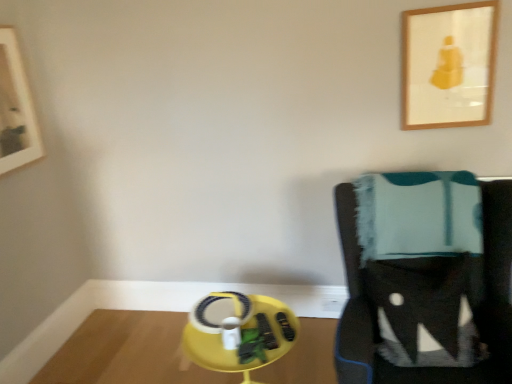
Question: Considering the relative sizes of yellow plastic table at lower center and knitted wool blanket at right in the image provided, is yellow plastic table at lower center smaller than knitted wool blanket at right?

Choices:
 (A) no
 (B) yes

Answer: (B)

Question: Is yellow plastic table at lower center positioned behind knitted wool blanket at right?

Choices:
 (A) yes
 (B) no

Answer: (A)

Question: Is yellow plastic table at lower center bigger than knitted wool blanket at right?

Choices:
 (A) yes
 (B) no

Answer: (B)

Question: Could knitted wool blanket at right be considered to be inside yellow plastic table at lower center?

Choices:
 (A) no
 (B) yes

Answer: (A)

Question: From a real-world perspective, is yellow plastic table at lower center under knitted wool blanket at right?

Choices:
 (A) yes
 (B) no

Answer: (A)

Question: Would you say yellow plastic table at lower center is outside knitted wool blanket at right?

Choices:
 (A) yes
 (B) no

Answer: (A)

Question: Does knitted wool blanket at right come behind wooden picture frame at upper left, the 1th picture frame from the left?

Choices:
 (A) no
 (B) yes

Answer: (A)

Question: From the image's perspective, does knitted wool blanket at right appear lower than wooden picture frame at upper left, the 1th picture frame from the left?

Choices:
 (A) no
 (B) yes

Answer: (B)

Question: Is wooden picture frame at upper left, positioned as the second picture frame in right-to-left order, surrounded by knitted wool blanket at right?

Choices:
 (A) no
 (B) yes

Answer: (A)

Question: Does knitted wool blanket at right come in front of wooden picture frame at upper left, positioned as the second picture frame in right-to-left order?

Choices:
 (A) no
 (B) yes

Answer: (B)

Question: Is knitted wool blanket at right placed right next to wooden picture frame at upper left, the 1th picture frame from the left?

Choices:
 (A) no
 (B) yes

Answer: (A)

Question: Can you confirm if knitted wool blanket at right is taller than wooden picture frame at upper left, the 1th picture frame from the left?

Choices:
 (A) no
 (B) yes

Answer: (B)

Question: From a real-world perspective, is yellow plastic table at lower center located higher than wooden picture frame at upper right, marked as the first picture frame in a right-to-left arrangement?

Choices:
 (A) no
 (B) yes

Answer: (A)